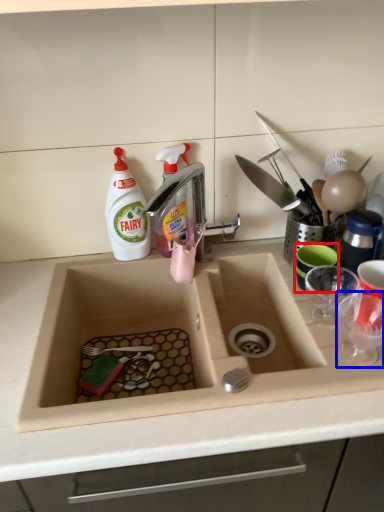
Question: Which object appears closest to the camera in this image, tableware (highlighted by a red box) or tableware (highlighted by a blue box)?

Choices:
 (A) tableware
 (B) tableware

Answer: (B)